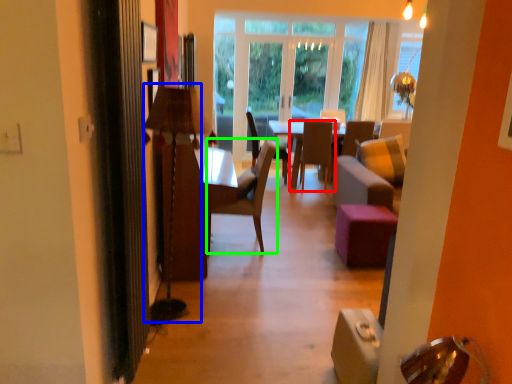
Question: Estimate the real-world distances between objects in this image. Which object is farther from chair (highlighted by a red box), lamp (highlighted by a blue box) or chair (highlighted by a green box)?

Choices:
 (A) lamp
 (B) chair

Answer: (A)